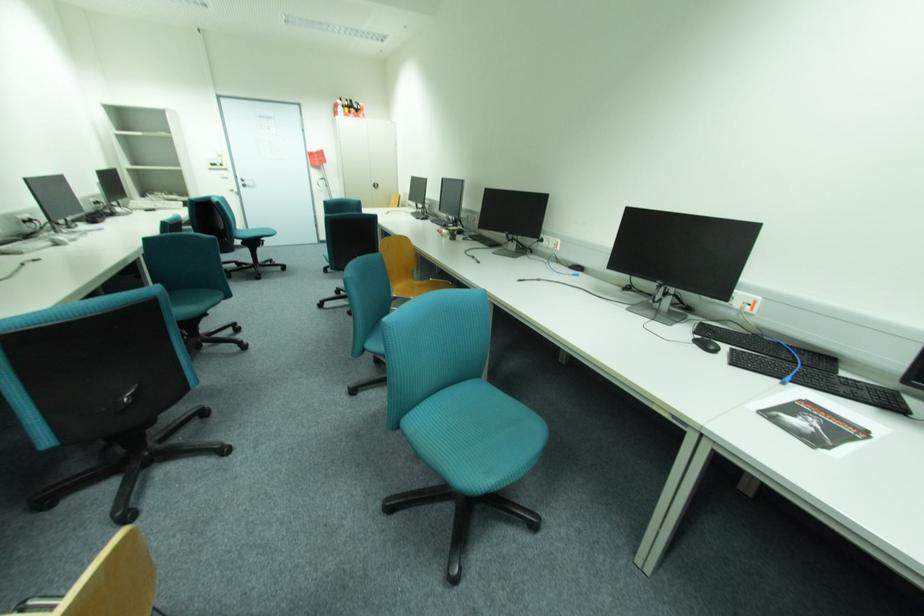
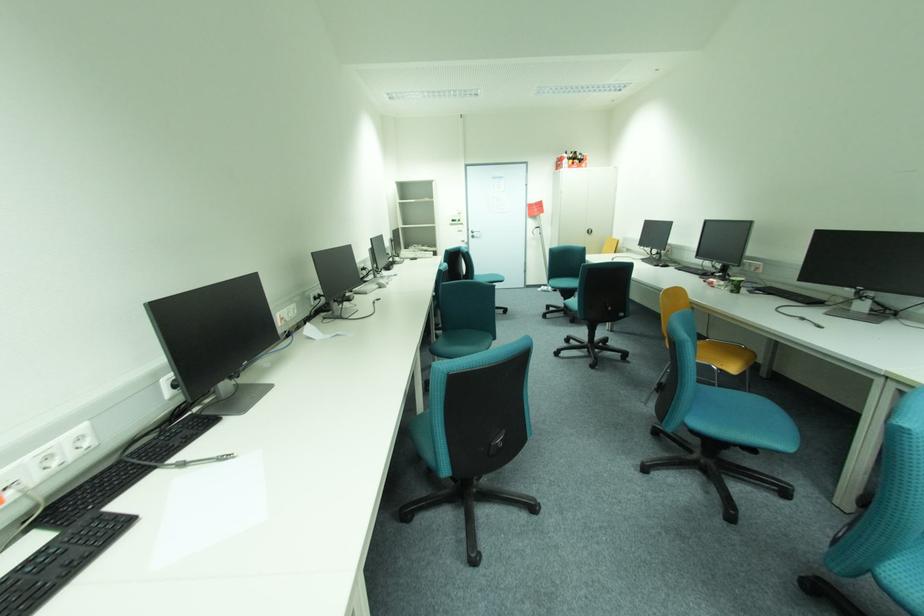
Question: The images are taken continuously from a first-person perspective. In which direction is your viewpoint rotating?

Choices:
 (A) Left
 (B) Right
 (C) Up
 (D) Down

Answer: (A)